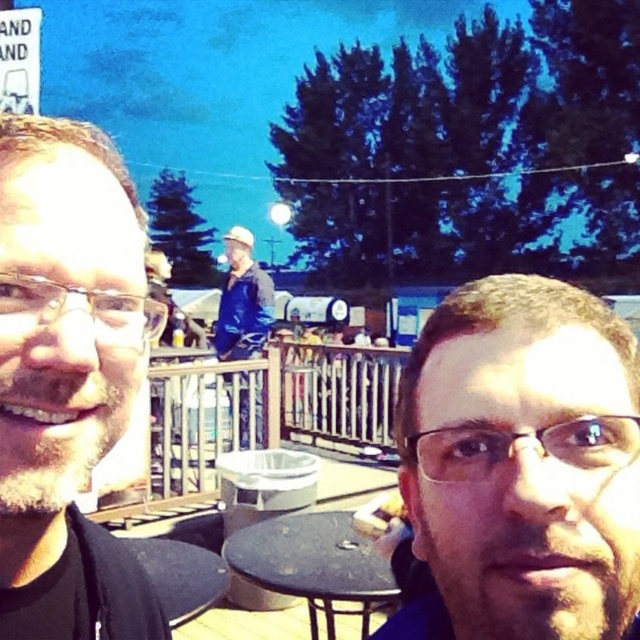
Question: Is matte black glasses at center to the left of blue denim jacket at center from the viewer's perspective?

Choices:
 (A) yes
 (B) no

Answer: (B)

Question: Is matte black glasses at center in front of black glass table at lower center?

Choices:
 (A) yes
 (B) no

Answer: (A)

Question: Which object is the closest to the black matte face at left?

Choices:
 (A) blue denim jacket at center
 (B) black glass table at lower center

Answer: (B)

Question: Which object is closer to the camera taking this photo?

Choices:
 (A) black matte face at left
 (B) matte black glasses at center

Answer: (B)

Question: Which point is closer to the camera?

Choices:
 (A) matte black glasses at center
 (B) black matte face at left
 (C) black glass table at lower center

Answer: (A)

Question: Where is black matte face at left located in relation to blue denim jacket at center in the image?

Choices:
 (A) below
 (B) above

Answer: (B)